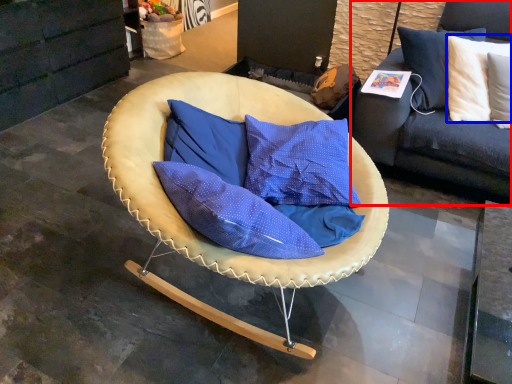
Question: Which object appears closest to the camera in this image, studio couch (highlighted by a red box) or pillow (highlighted by a blue box)?

Choices:
 (A) studio couch
 (B) pillow

Answer: (B)